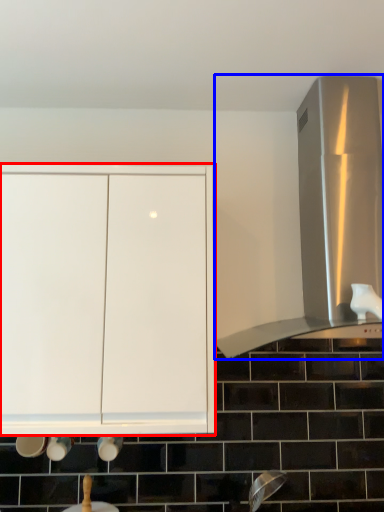
Question: Which point is closer to the camera, cabinetry (highlighted by a red box) or vent (highlighted by a blue box)?

Choices:
 (A) cabinetry
 (B) vent

Answer: (A)